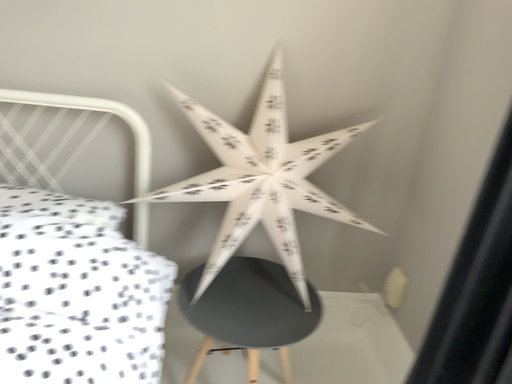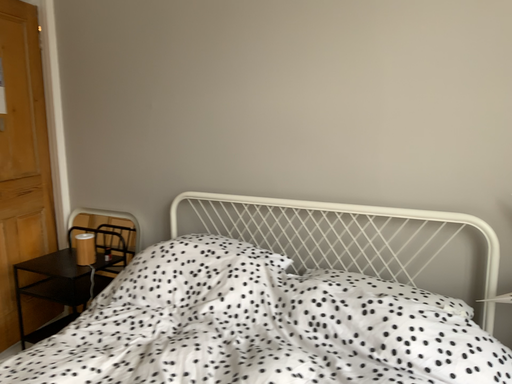
Question: Which way did the camera rotate in the video?

Choices:
 (A) rotated left
 (B) rotated right

Answer: (A)